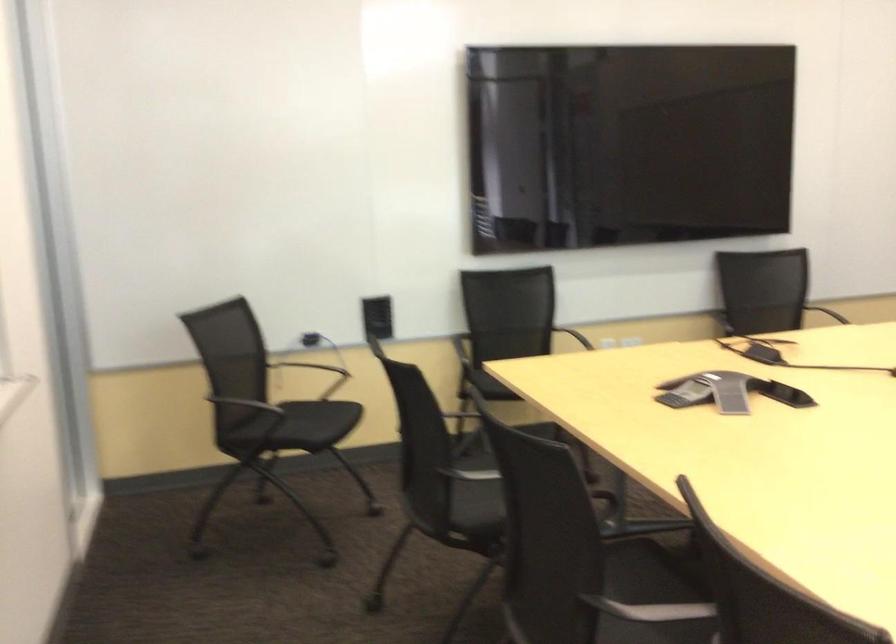
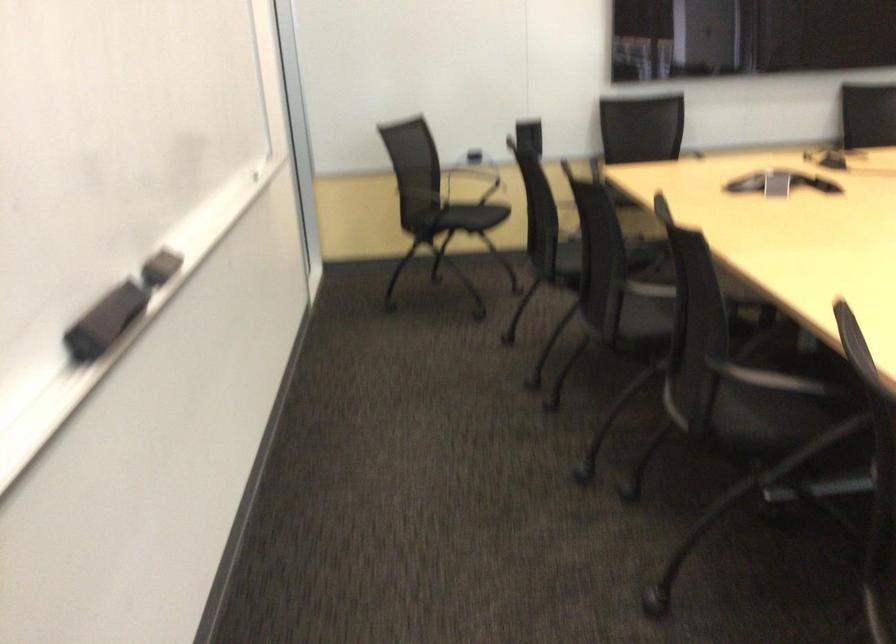
Question: I am providing you with two images of the same scene from different viewpoints. Which of the following objects are not visible in image2?

Choices:
 (A) chair armrest
 (B) black whiteboard eraser
 (C) chair sitting surface
 (D) none of these

Answer: (D)